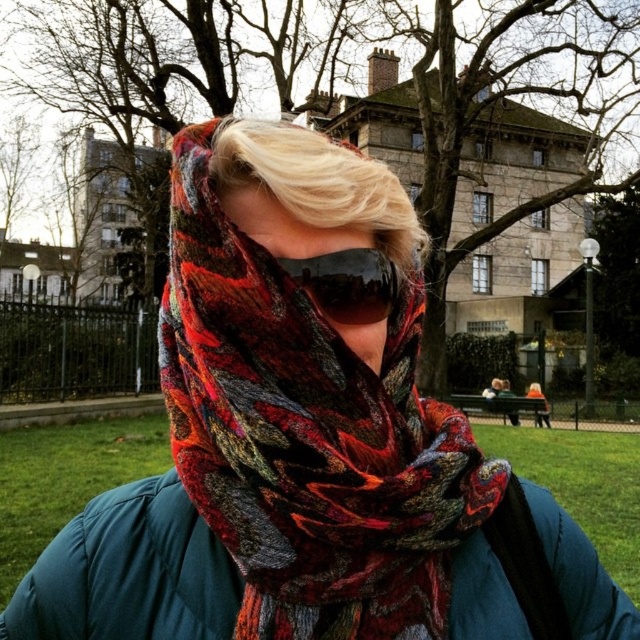
Who is shorter, teal quilted jacket at center or glossy plastic goggles at center?

Standing shorter between the two is glossy plastic goggles at center.

Which is more to the right, teal quilted jacket at center or glossy plastic goggles at center?

glossy plastic goggles at center is more to the right.

What do you see at coordinates (129, 572) in the screenshot? This screenshot has width=640, height=640. I see `teal quilted jacket at center` at bounding box center [129, 572].

Locate an element on the screen. The height and width of the screenshot is (640, 640). teal quilted jacket at center is located at coordinates (129, 572).

Is the position of glossy plastic goggles at center less distant than that of orange knit hat at center?

That is True.

Is glossy plastic goggles at center thinner than orange knit hat at center?

Yes, glossy plastic goggles at center is thinner than orange knit hat at center.

At what (x,y) coordinates should I click in order to perform the action: click on glossy plastic goggles at center. Please return your answer as a coordinate pair (x, y). Looking at the image, I should click on (348, 284).

Locate an element on the screen. This screenshot has width=640, height=640. glossy plastic goggles at center is located at coordinates (348, 284).

Does point (448, 477) come behind point (323, 308)?

No, (448, 477) is closer to viewer.

Based on the photo, can you confirm if multicolored knitted scarf at center is thinner than glossy plastic goggles at center?

In fact, multicolored knitted scarf at center might be wider than glossy plastic goggles at center.

The image size is (640, 640). What do you see at coordinates (307, 438) in the screenshot?
I see `multicolored knitted scarf at center` at bounding box center [307, 438].

Image resolution: width=640 pixels, height=640 pixels. I want to click on multicolored knitted scarf at center, so click(x=307, y=438).